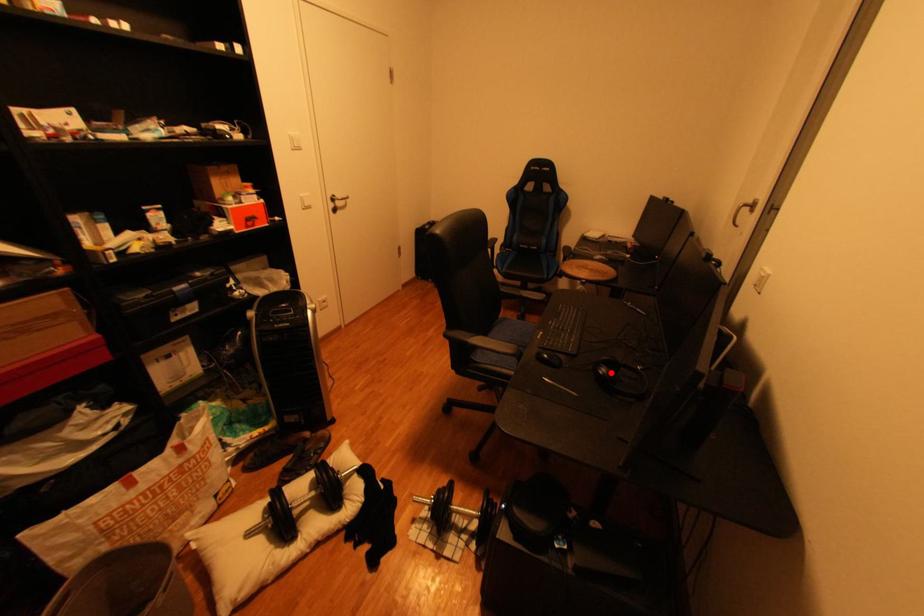
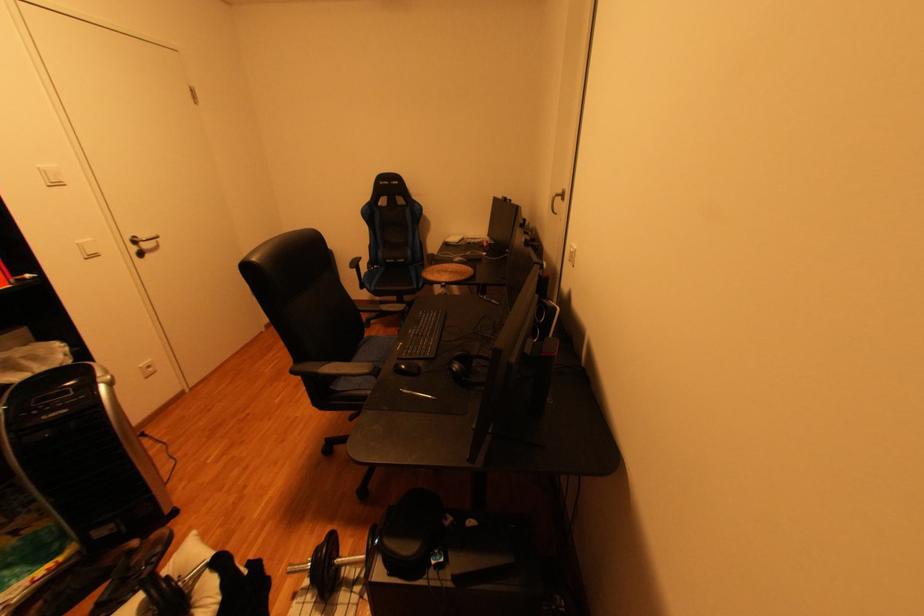
Question: I am providing you with two images of the same scene from different viewpoints. A red point is marked on the first image. Can you still see the location of the red point in image 2?

Choices:
 (A) Yes
 (B) No

Answer: (A)